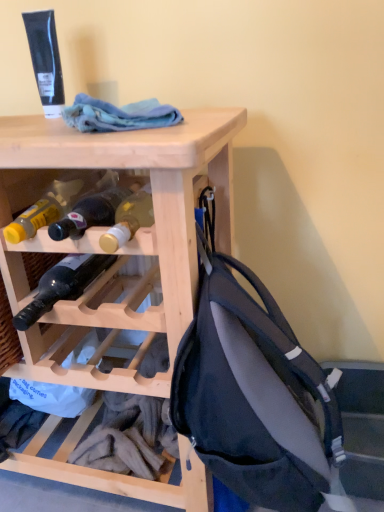
Question: Is matte glass bottle at center, the 1th bottle viewed from the top, wider or thinner than matte black backpack at right?

Choices:
 (A) wide
 (B) thin

Answer: (A)

Question: Would you say matte glass bottle at center, the 1th bottle viewed from the top, is to the left or to the right of matte black backpack at right in the picture?

Choices:
 (A) left
 (B) right

Answer: (A)

Question: Estimate the real-world distances between objects in this image. Which object is farther from the matte black backpack at right?

Choices:
 (A) blue cotton cloth at upper center
 (B) matte glass bottle at center, acting as the second bottle starting from the bottom
 (C) natural wood wine rack at upper center
 (D) dark glass bottle at center, arranged as the 2th bottle when viewed from the top

Answer: (A)

Question: Based on their relative distances, which object is nearer to the dark glass bottle at center, arranged as the 2th bottle when viewed from the top?

Choices:
 (A) matte black backpack at right
 (B) natural wood wine rack at upper center
 (C) matte glass bottle at center, acting as the second bottle starting from the bottom
 (D) blue cotton cloth at upper center

Answer: (C)